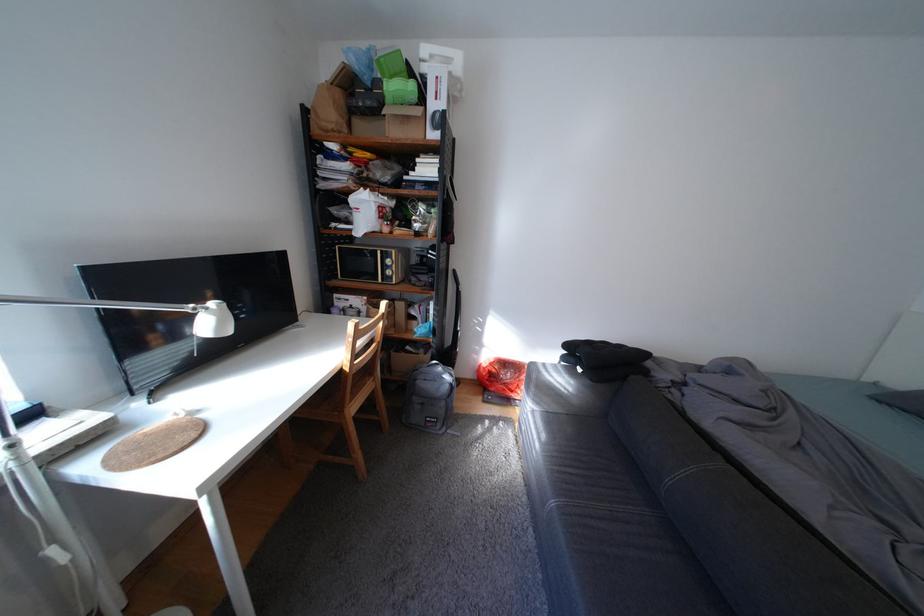
Where is `white lamp head`? This screenshot has height=616, width=924. white lamp head is located at coordinates (213, 320).